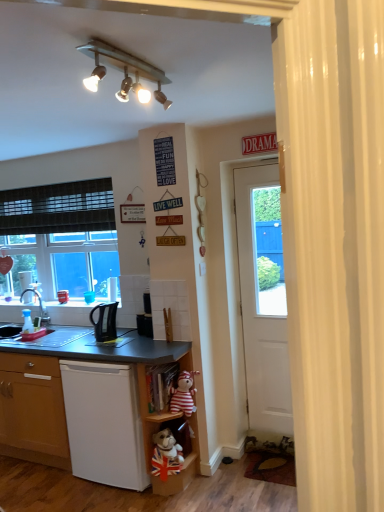
Find the location of a particular element. This screenshot has width=384, height=512. vacant space in front of black plastic kettle at lower left is located at coordinates (106, 347).